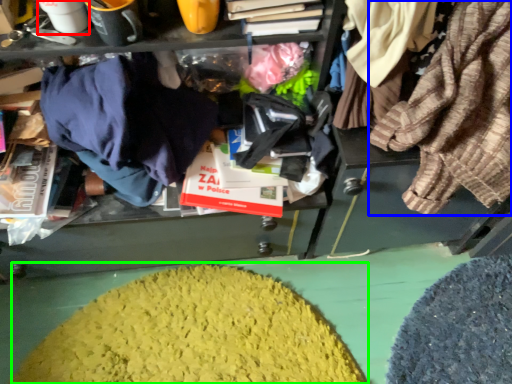
Question: Which object is the farthest from coffee cup (highlighted by a red box)? Choose among these: clothing (highlighted by a blue box) or debris (highlighted by a green box).

Choices:
 (A) clothing
 (B) debris

Answer: (B)